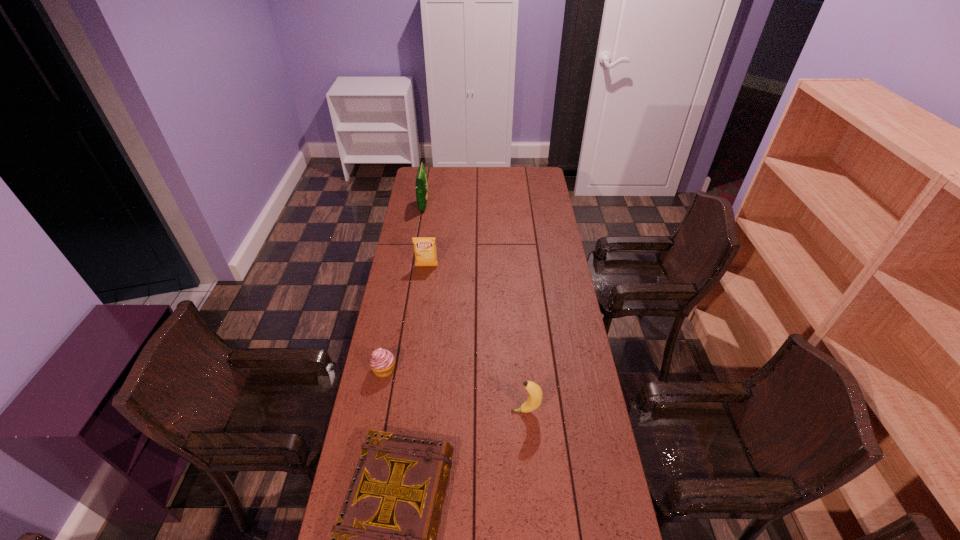
I want to click on vacant space located 0.100m from the stem of the second nearest object, so click(x=482, y=411).

Find the location of a particular element. Image resolution: width=960 pixels, height=540 pixels. free region located 0.140m from the stem of the second nearest object is located at coordinates (469, 411).

At what (x,y) coordinates should I click in order to perform the action: click on free space located on the front of the shorter crisp (potato chip) with the logo. Please return your answer as a coordinate pair (x, y). Looking at the image, I should click on (424, 284).

The height and width of the screenshot is (540, 960). I want to click on vacant space situated on the front of the cupcake, so (368, 457).

Locate an element on the screen. The image size is (960, 540). cupcake present at the left edge is located at coordinates (382, 362).

Locate an element on the screen. The width and height of the screenshot is (960, 540). free space at the far edge of the desktop is located at coordinates (518, 185).

In the image, there is a desktop. At what (x,y) coordinates should I click in order to perform the action: click on vacant space at the left edge. Please return your answer as a coordinate pair (x, y). This screenshot has width=960, height=540. Looking at the image, I should click on coord(410,319).

Locate an element on the screen. The width and height of the screenshot is (960, 540). free point at the right edge is located at coordinates (579, 472).

Identify the location of vacant space at the far right corner of the desktop. (545, 185).

Identify the location of free space between the third farthest object and the tallest object. (404, 288).